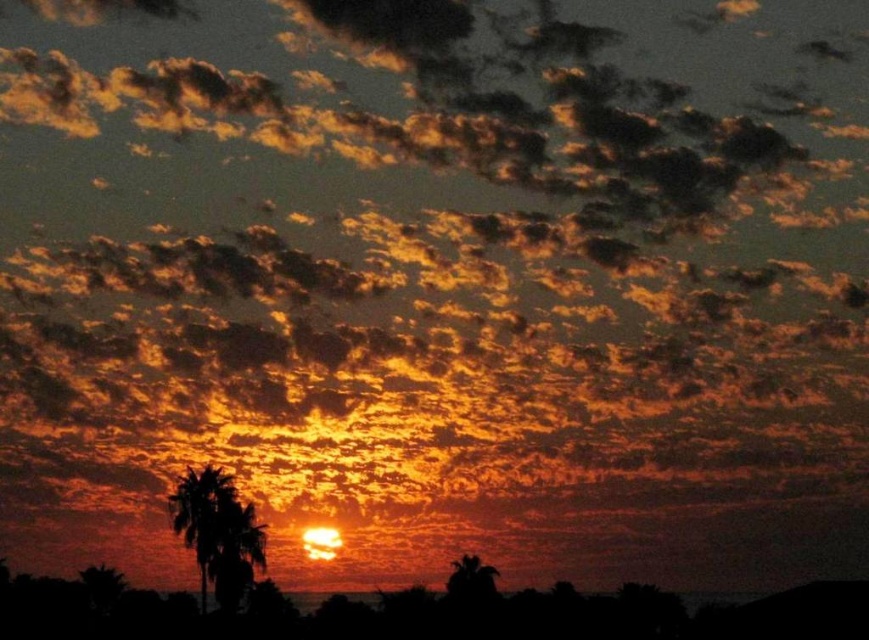
You are standing in the sunset scene and want to take a photo of both silhouette palm tree at left and silhouette palm tree at lower right. Which palm tree should you focus on first to ensure both are in the frame?

You should focus on the silhouette palm tree at left first because it is closer to you than the silhouette palm tree at lower right, allowing both to be captured in the frame when adjusting the camera.

You are standing at the point with coordinates point [217,532]. Looking at the silhouette palm tree at left, where would you see it in relation to your position?

The silhouette palm tree at left is located at point [217,532], so you are standing exactly at the position of the silhouette palm tree at left.